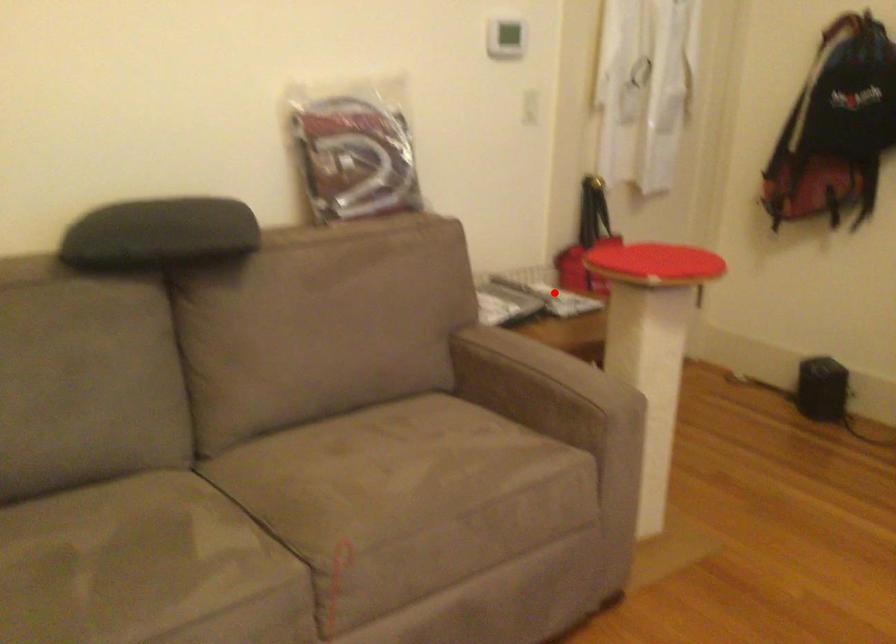
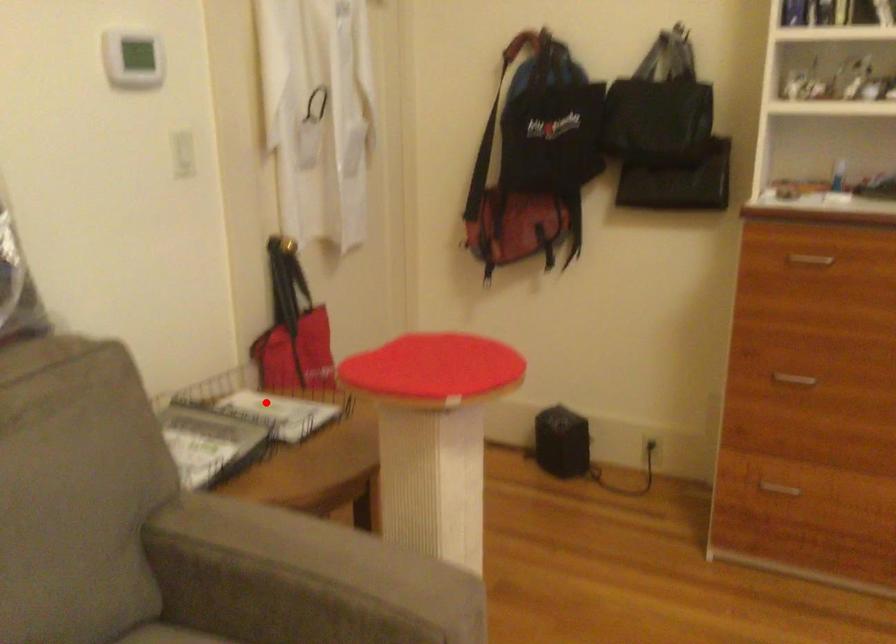
I am providing you with two images of the same scene from different viewpoints. A red point is marked on the first image and another point is marked on the second image. Does the point marked in image1 correspond to the same location as the one in image2?

Yes